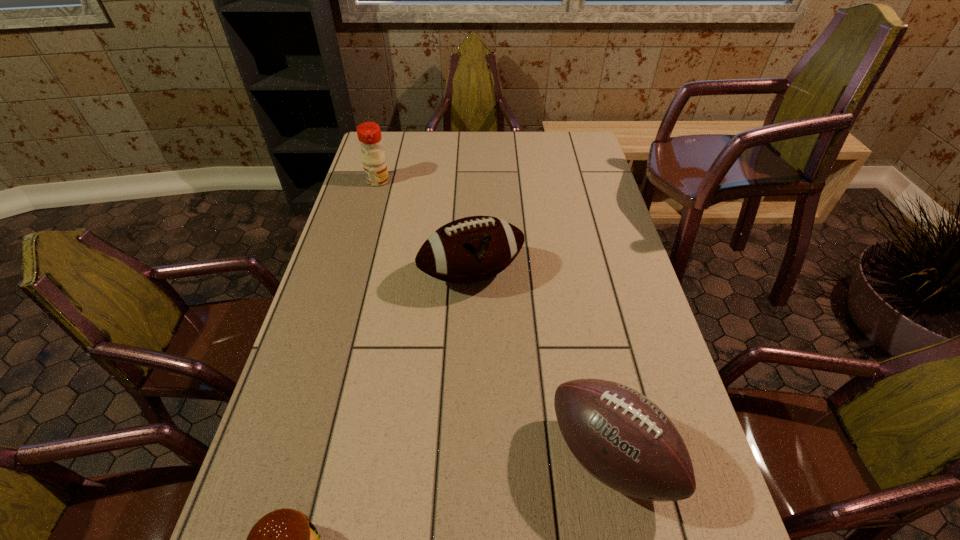
In order to click on free space between the nearer football (American) and the farther football (American) in this screenshot , I will do `click(540, 365)`.

The image size is (960, 540). In order to click on free space between the second farthest object and the rightmost object in this screenshot , I will do `click(540, 365)`.

The width and height of the screenshot is (960, 540). Identify the location of object that stands as the second closest to the nearest object. (472, 249).

The height and width of the screenshot is (540, 960). Identify the location of object that is the second closest to the condiment. (624, 440).

The width and height of the screenshot is (960, 540). What are the coordinates of `free space that satisfies the following two spatial constraints: 1. on the front side of the rightmost object; 2. on the left side of the condiment` in the screenshot? It's located at (300, 456).